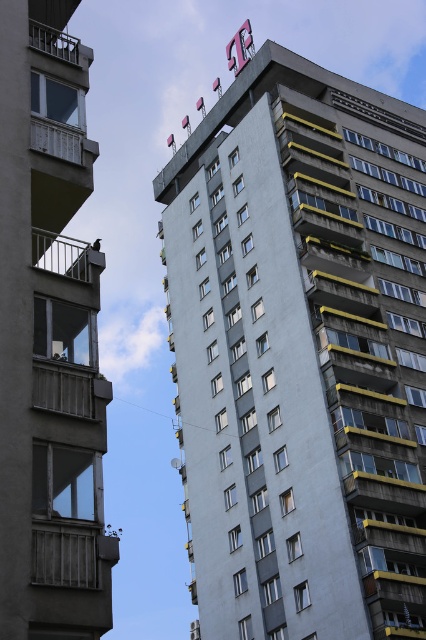
Does concrete balcony at left come behind white painted wood balcony at left?

No, concrete balcony at left is in front of white painted wood balcony at left.

In the scene shown: Who is taller, concrete balcony at left or white painted wood balcony at left?

concrete balcony at left

Between point (57, 330) and point (39, 134), which one is positioned behind?

Positioned behind is point (39, 134).

Find the location of a particular element. Image resolution: width=426 pixels, height=640 pixels. concrete balcony at left is located at coordinates (48, 352).

At what (x,y) coordinates should I click in order to perform the action: click on wooden balcony at lower left. Please return your answer as a coordinate pair (x, y). Image resolution: width=426 pixels, height=640 pixels. Looking at the image, I should click on (69, 554).

Based on the photo, does wooden balcony at lower left appear on the right side of metallic railing at upper left?

Yes, wooden balcony at lower left is to the right of metallic railing at upper left.

Find the location of a particular element. wooden balcony at lower left is located at coordinates (69, 554).

I want to click on wooden balcony at lower left, so click(x=69, y=554).

Does wooden balcony at lower left lie behind white painted wood balcony at left?

No, it is not.

Can you confirm if wooden balcony at lower left is positioned below white painted wood balcony at left?

Indeed, wooden balcony at lower left is positioned under white painted wood balcony at left.

You are a GUI agent. You are given a task and a screenshot of the screen. Output one action in this format:
    pyautogui.click(x=<x>, y=<y>)
    Task: Click on the wooden balcony at lower left
    
    Given the screenshot: What is the action you would take?
    click(x=69, y=554)